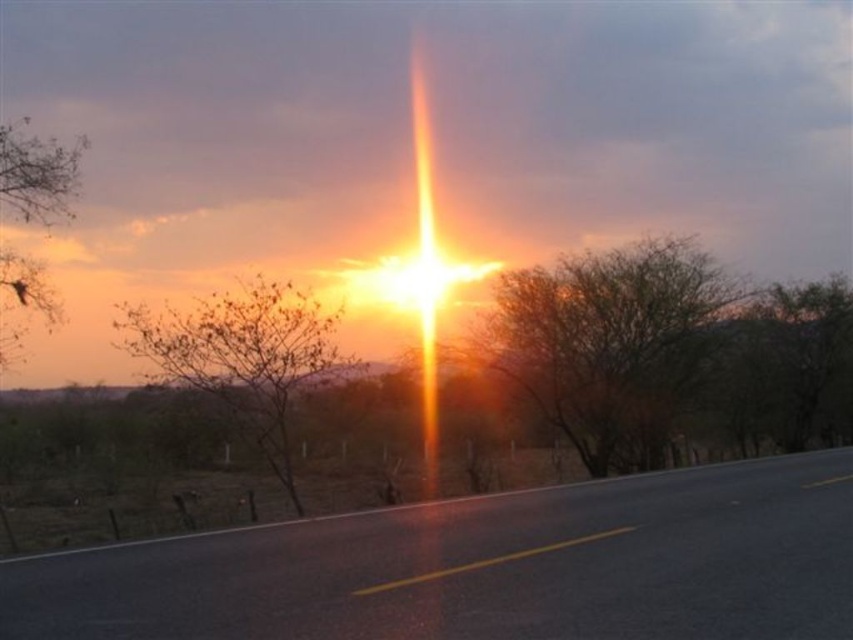
Can you confirm if brown textured tree at center is positioned below brown leafy tree at center?

Incorrect, brown textured tree at center is not positioned below brown leafy tree at center.

Based on the photo, can you confirm if brown textured tree at center is thinner than brown leafy tree at center?

In fact, brown textured tree at center might be wider than brown leafy tree at center.

Describe the element at coordinates (604, 340) in the screenshot. I see `brown textured tree at center` at that location.

This screenshot has height=640, width=853. In order to click on brown textured tree at center in this screenshot , I will do `click(604, 340)`.

Which is more to the right, brown textured tree at center or bare branches at left?

Positioned to the right is brown textured tree at center.

Locate an element on the screen. The image size is (853, 640). brown textured tree at center is located at coordinates (604, 340).

What do you see at coordinates (604, 340) in the screenshot? I see `brown textured tree at center` at bounding box center [604, 340].

Locate an element on the screen. The height and width of the screenshot is (640, 853). brown textured tree at center is located at coordinates (604, 340).

How much distance is there between brown leafy tree at center and bare branches at left?

They are 7.15 meters apart.

Is brown leafy tree at center taller than bare branches at left?

No.

You are a GUI agent. You are given a task and a screenshot of the screen. Output one action in this format:
    pyautogui.click(x=<x>, y=<y>)
    Task: Click on the brown leafy tree at center
    This screenshot has height=640, width=853.
    Given the screenshot: What is the action you would take?
    pyautogui.click(x=242, y=356)